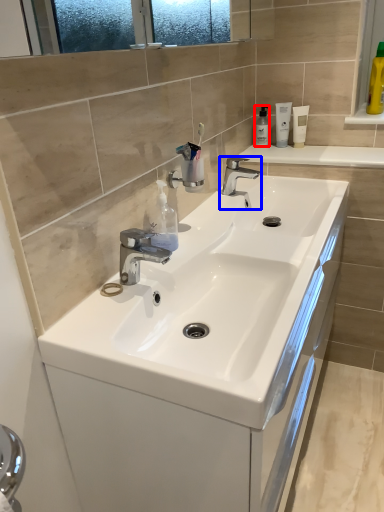
Question: Which point is closer to the camera, toiletry (highlighted by a red box) or tap (highlighted by a blue box)?

Choices:
 (A) toiletry
 (B) tap

Answer: (B)